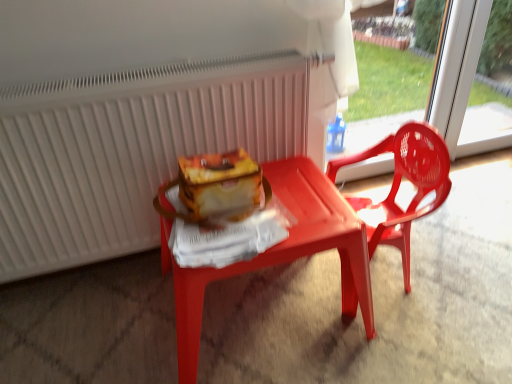
Question: Would you say white matte radiator at upper center is inside or outside matte plastic table at center?

Choices:
 (A) inside
 (B) outside

Answer: (B)

Question: From their relative heights in the image, would you say white matte radiator at upper center is taller or shorter than matte plastic table at center?

Choices:
 (A) short
 (B) tall

Answer: (B)

Question: Which of these objects is positioned farthest from the matte plastic table at center?

Choices:
 (A) matte plastic chair at right
 (B) transparent plastic screen door at upper right
 (C) white matte radiator at upper center

Answer: (B)

Question: Considering the real-world distances, which object is closest to the transparent plastic screen door at upper right?

Choices:
 (A) white matte radiator at upper center
 (B) matte plastic chair at right
 (C) matte plastic table at center

Answer: (B)